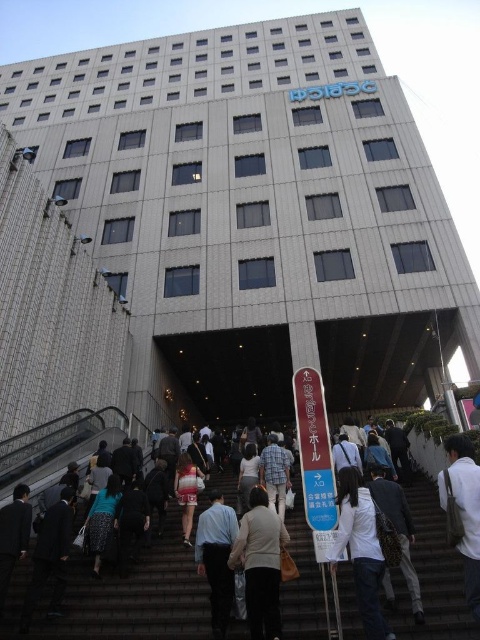
You are standing at the bottom of the gray concrete stairs at center and want to give a gift to a person wearing the light beige sweater at center. Since the stairs are not as tall as the sweater, will you need to climb the stairs to reach the person?

The gray concrete stairs at center is not as tall as the light beige sweater at center, so the stairs are shorter than the person wearing the sweater. Therefore, you will need to climb the stairs to reach the person wearing the light beige sweater at center.

You are standing at the base of the staircase in front of the building. You see two points marked on the ground. The first point is at coordinates point (380, 627) and the second point is at point (477, 504). Which point is closer to the building entrance?

Point (380, 627) is in front of point (477, 504), so the first point is closer to the building entrance.